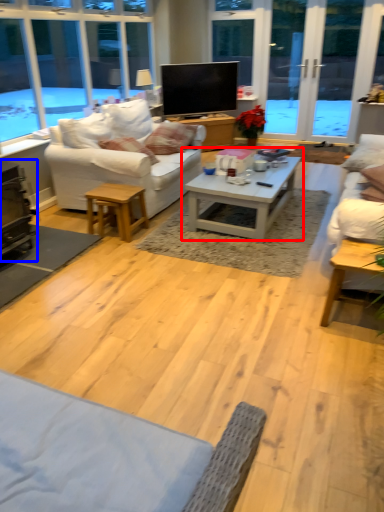
Question: Which point is further to the camera, coffee table (highlighted by a red box) or fireplace (highlighted by a blue box)?

Choices:
 (A) coffee table
 (B) fireplace

Answer: (B)